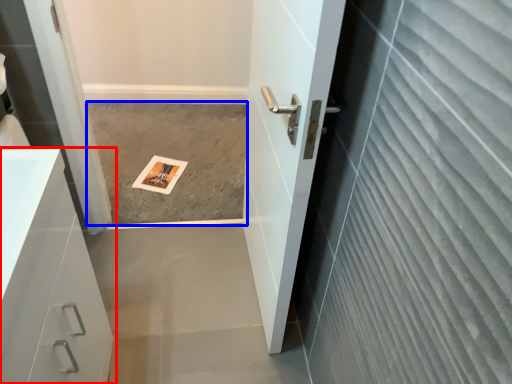
Question: Which object is closer to the camera taking this photo, bathroom cabinet (highlighted by a red box) or concrete (highlighted by a blue box)?

Choices:
 (A) bathroom cabinet
 (B) concrete

Answer: (A)